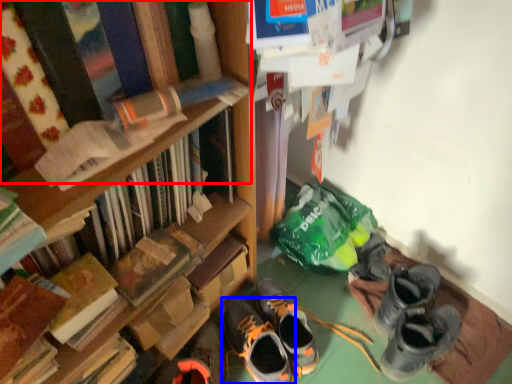
Question: Which object appears closest to the camera in this image, book (highlighted by a red box) or footwear (highlighted by a blue box)?

Choices:
 (A) book
 (B) footwear

Answer: (A)